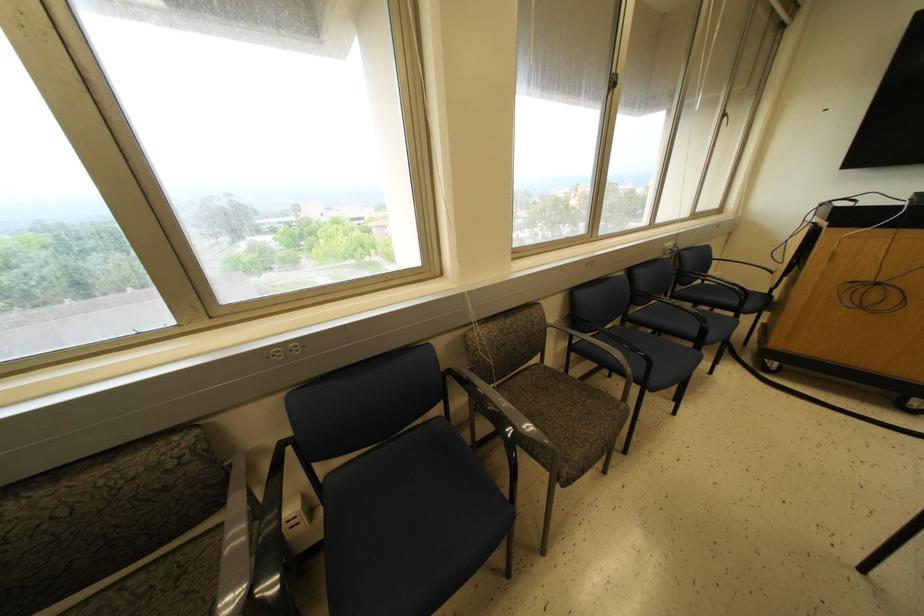
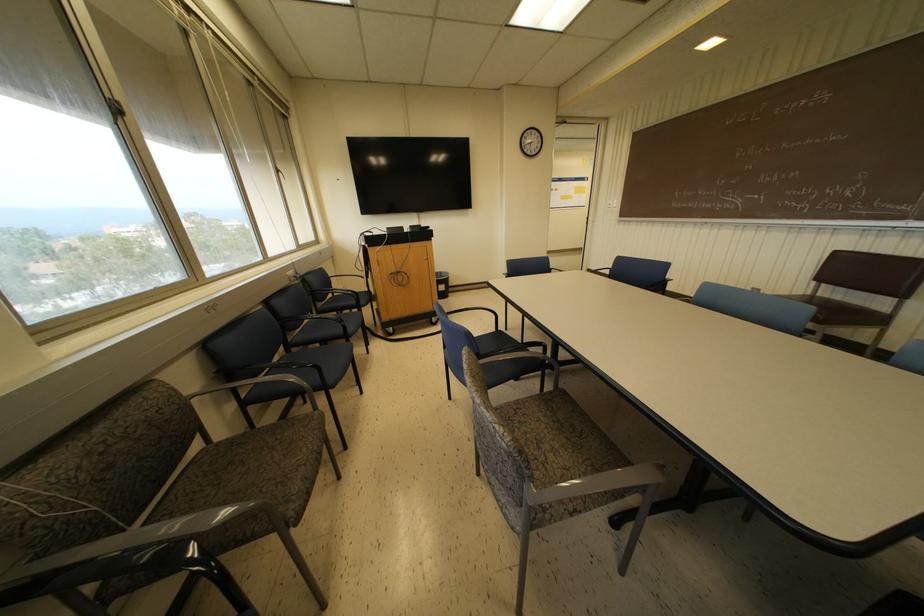
Question: The camera is either moving clockwise (left) or counter-clockwise (right) around the object. The first image is from the beginning of the video and the second image is from the end. Is the camera moving left or right when shooting the video?

Choices:
 (A) Left
 (B) Right

Answer: (A)